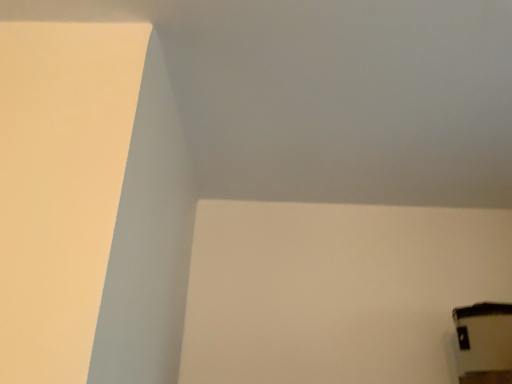
This screenshot has width=512, height=384. I want to click on black plastic window at lower right, so click(484, 342).

In order to face black plastic window at lower right, should I rotate leftwards or rightwards?

A 30.963 degree turn to the right will do.

This screenshot has width=512, height=384. Describe the element at coordinates (484, 342) in the screenshot. I see `black plastic window at lower right` at that location.

In order to click on black plastic window at lower right in this screenshot , I will do click(484, 342).